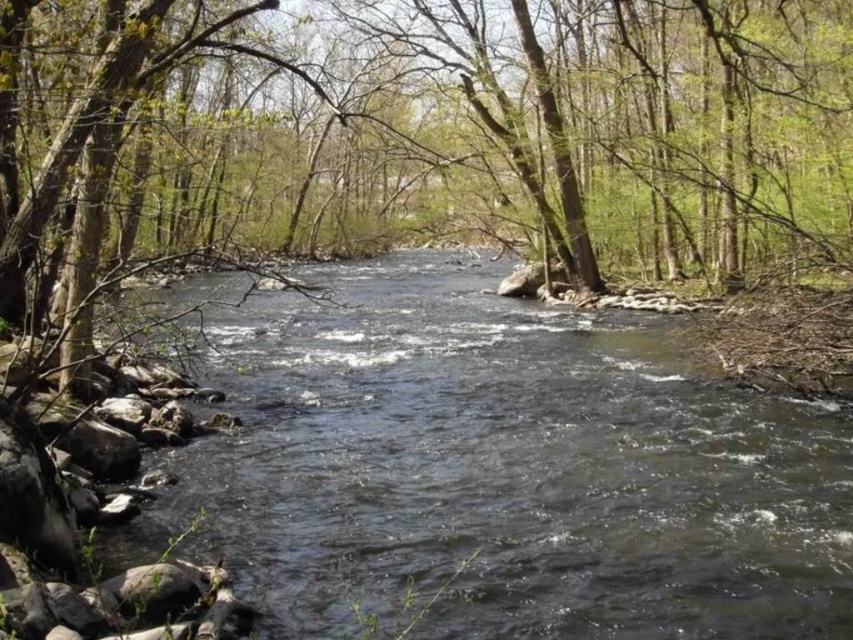
Can you confirm if brown wood tree at center is positioned to the left of clear water stream at center?

Yes, brown wood tree at center is to the left of clear water stream at center.

Is brown wood tree at center below clear water stream at center?

No.

Identify the location of brown wood tree at center. This screenshot has height=640, width=853. coord(448,148).

Locate an element on the screen. brown wood tree at center is located at coordinates (448, 148).